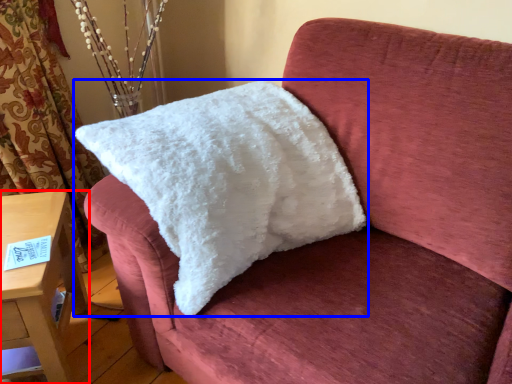
Question: Which of the following is the closest to the observer, furniture (highlighted by a red box) or pillow (highlighted by a blue box)?

Choices:
 (A) furniture
 (B) pillow

Answer: (B)